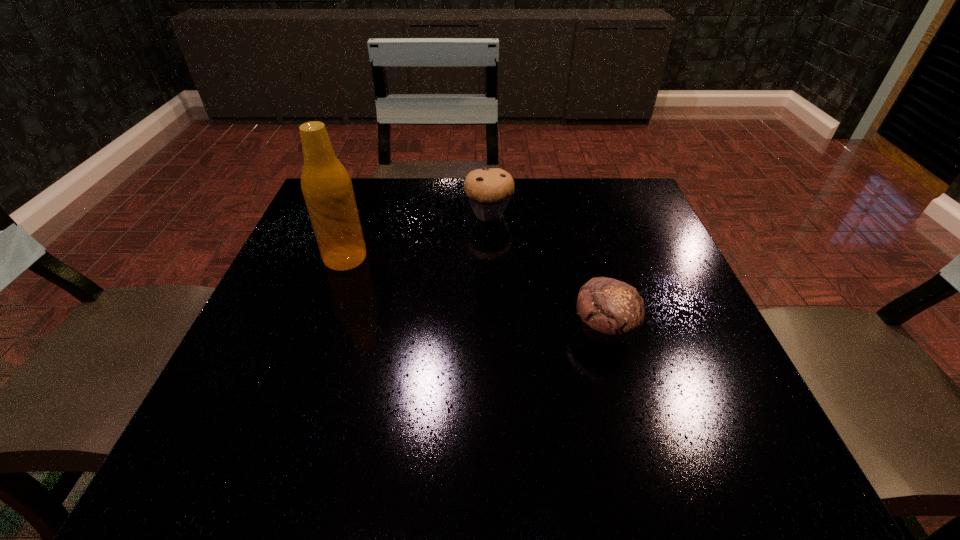
Locate an element on the screen. free point between the nearer muffin and the second nearest object is located at coordinates (475, 294).

Identify the location of vacant region between the nearer muffin and the left muffin. (546, 272).

Locate an element on the screen. free space that is in between the second object from left to right and the nearest object is located at coordinates (546, 272).

I want to click on vacant area that lies between the farthest object and the nearer muffin, so click(x=546, y=272).

Find the location of a particular element. empty location between the tallest object and the farther muffin is located at coordinates [417, 235].

At what (x,y) coordinates should I click in order to perform the action: click on vacant point located between the left muffin and the nearer muffin. Please return your answer as a coordinate pair (x, y). The width and height of the screenshot is (960, 540). Looking at the image, I should click on (546, 272).

The image size is (960, 540). Identify the location of free spot between the farther muffin and the rightmost object. (546, 272).

You are a GUI agent. You are given a task and a screenshot of the screen. Output one action in this format:
    pyautogui.click(x=<x>, y=<y>)
    Task: Click on the second closest object to the nearest object
    The height and width of the screenshot is (540, 960).
    Given the screenshot: What is the action you would take?
    pyautogui.click(x=326, y=186)

Identify the location of object that is the second closest one to the second object from right to left. This screenshot has height=540, width=960. (610, 310).